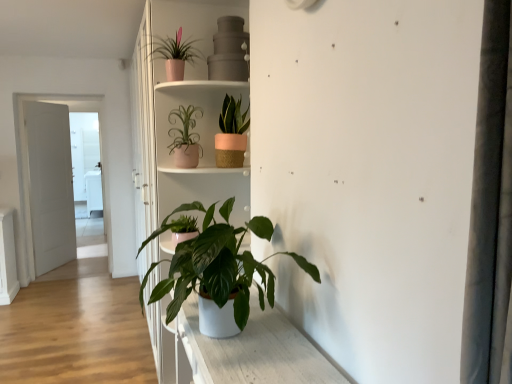
Question: Based on their sizes in the image, would you say matte pink pot at upper center, acting as the second houseplant starting from the bottom, is bigger or smaller than green matte plant at center, which is counted as the 1th houseplant, starting from the bottom?

Choices:
 (A) big
 (B) small

Answer: (B)

Question: Does point 188,158 appear closer or farther from the camera than point 177,289?

Choices:
 (A) farther
 (B) closer

Answer: (A)

Question: Which object is positioned closest to the green matte plant at center, positioned as the 4th houseplant in top-to-bottom order?

Choices:
 (A) white matte door at left
 (B) white matte bookshelf at center
 (C) pink matte pot at upper center, marked as the 1th houseplant in a top-to-bottom arrangement
 (D) matte pink pot at upper center, which is the third houseplant in top-to-bottom order
 (E) matte pink woven pot at upper center, the 2th houseplant positioned from the top

Answer: (B)

Question: Based on their relative distances, which object is nearer to the green matte plant at center, which is counted as the 1th houseplant, starting from the bottom?

Choices:
 (A) pink matte pot at upper center, the 4th houseplant when ordered from bottom to top
 (B) white matte door at left
 (C) white matte bookshelf at center
 (D) matte pink woven pot at upper center, the 2th houseplant positioned from the top
 (E) matte pink pot at upper center, acting as the second houseplant starting from the bottom

Answer: (C)